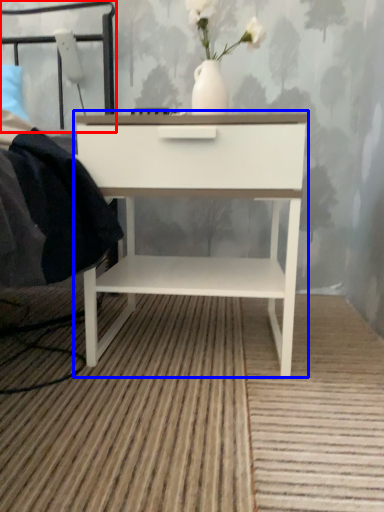
Question: Which of the following is the farthest to the observer, headboard (highlighted by a red box) or nightstand (highlighted by a blue box)?

Choices:
 (A) headboard
 (B) nightstand

Answer: (A)